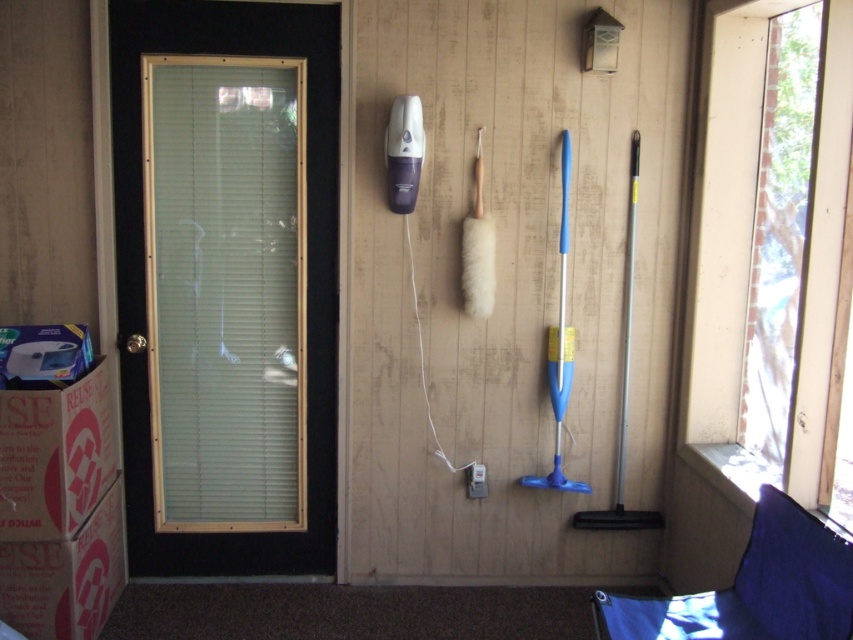
Question: Does black glass screen door at left appear on the left side of brown cardboard box at lower left?

Choices:
 (A) no
 (B) yes

Answer: (A)

Question: Can you confirm if clear glass window at upper right is thinner than brown cardboard box at lower left?

Choices:
 (A) yes
 (B) no

Answer: (B)

Question: Which point is farther to the camera?

Choices:
 (A) brown cardboard box at lower left
 (B) white cardboard box at lower left
 (C) black glass screen door at left

Answer: (C)

Question: Can you confirm if brown cardboard box at lower left is wider than white cardboard box at lower left?

Choices:
 (A) no
 (B) yes

Answer: (A)

Question: Which point is farther to the camera?

Choices:
 (A) (218, 557)
 (B) (711, 228)
 (C) (105, 452)
 (D) (22, 593)

Answer: (A)

Question: Estimate the real-world distances between objects in this image. Which object is farther from the clear glass window at upper right?

Choices:
 (A) brown cardboard box at lower left
 (B) white cardboard box at lower left

Answer: (B)